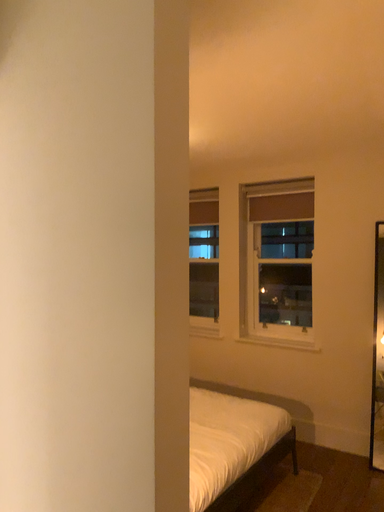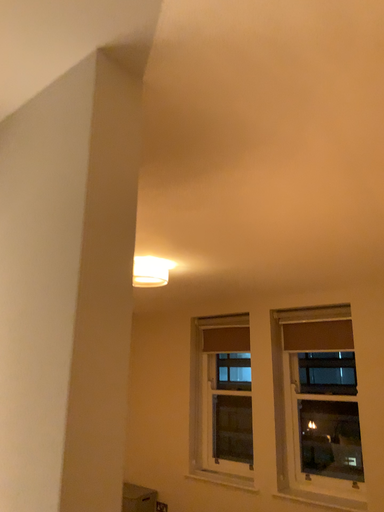
Question: How did the camera likely rotate when shooting the video?

Choices:
 (A) rotated upward
 (B) rotated downward

Answer: (A)